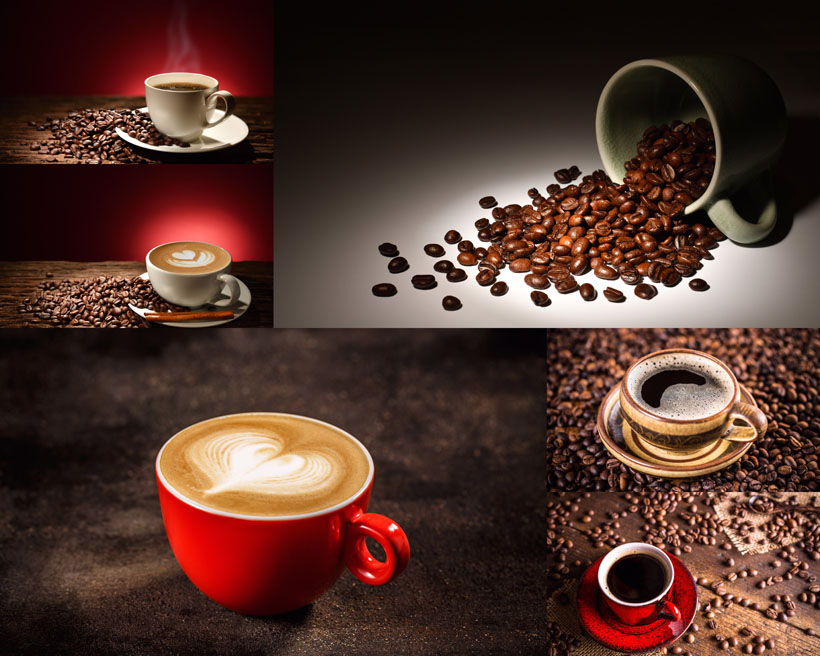
This screenshot has height=656, width=820. What are the coordinates of `plates` in the screenshot? It's located at (650, 454), (638, 632), (217, 316), (215, 142).